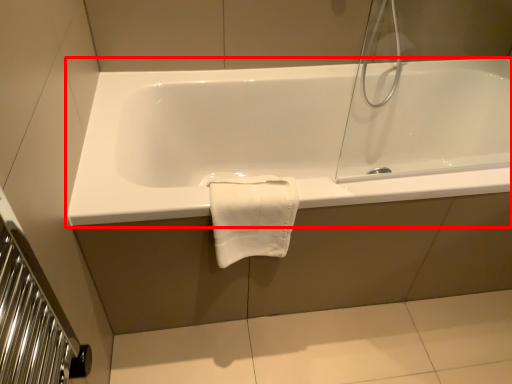
Question: From the image's perspective, what is the correct spatial positioning of bathtub (annotated by the red box) in reference to bath towel?

Choices:
 (A) above
 (B) below

Answer: (A)